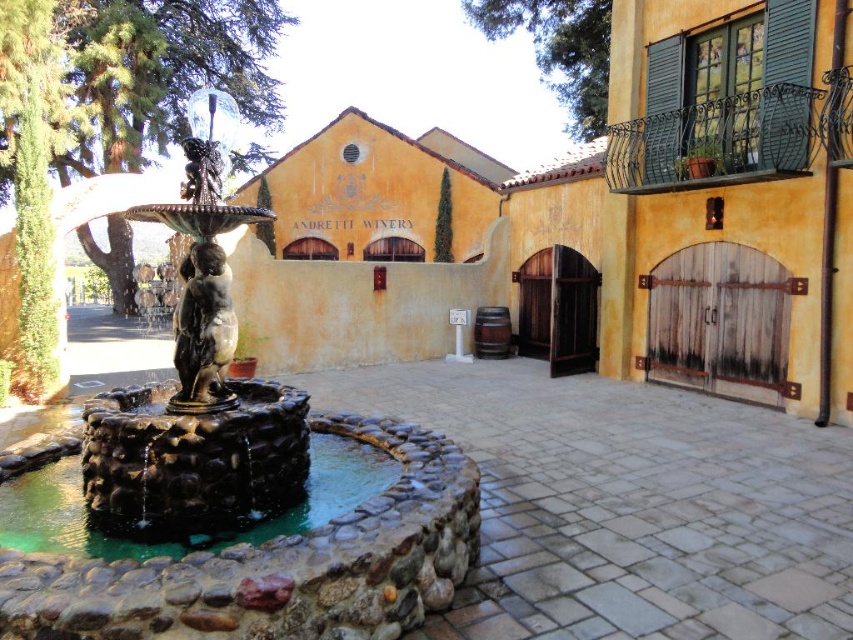
Can you confirm if polished bronze statue at center is positioned to the right of bronze statue at center?

In fact, polished bronze statue at center is to the left of bronze statue at center.

Can you confirm if polished bronze statue at center is wider than bronze statue at center?

Yes.

What do you see at coordinates (236, 481) in the screenshot?
I see `polished bronze statue at center` at bounding box center [236, 481].

Identify the location of polished bronze statue at center. This screenshot has width=853, height=640. (236, 481).

Does green stone fountain at center appear under bronze statue at center?

Correct, green stone fountain at center is located below bronze statue at center.

Can you confirm if green stone fountain at center is smaller than bronze statue at center?

Actually, green stone fountain at center might be larger than bronze statue at center.

Find the location of a particular element. The image size is (853, 640). green stone fountain at center is located at coordinates (187, 532).

Where is `green stone fountain at center`? The width and height of the screenshot is (853, 640). green stone fountain at center is located at coordinates (187, 532).

Between polished bronze statue at center and green stone fountain at center, which one appears on the left side from the viewer's perspective?

From the viewer's perspective, polished bronze statue at center appears more on the left side.

Between polished bronze statue at center and green stone fountain at center, which one is positioned higher?

polished bronze statue at center is higher up.

Is point (28, 561) more distant than point (71, 550)?

That is False.

Identify the location of polished bronze statue at center. (236, 481).